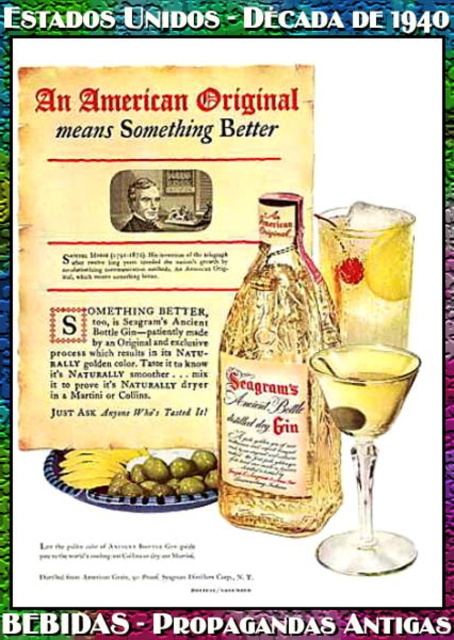
You are at a bar and see two drinks in front of you. One is the clear glass drink at center right and the other is the yellow liquid at center. Which drink is positioned more to the right?

The clear glass drink at center right is positioned more to the right than the yellow liquid at center.

You are an art conservator examining the Seagram advertisement. You need to determine the spatial relationship between the clear glass bottle at center and the clear glass drink at center right. Which object is positioned closer to the viewer?

The clear glass bottle at center is closer to the viewer than the clear glass drink at center right.